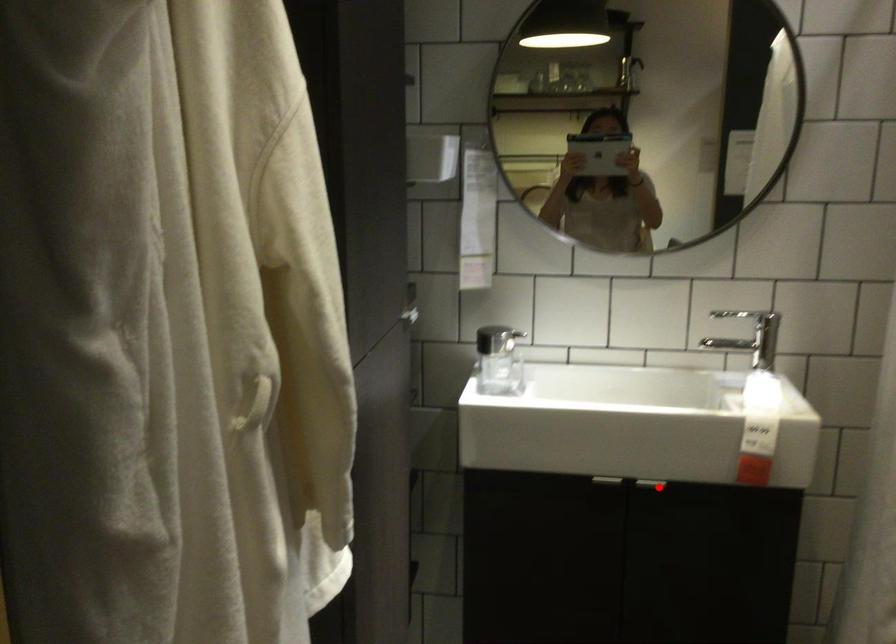
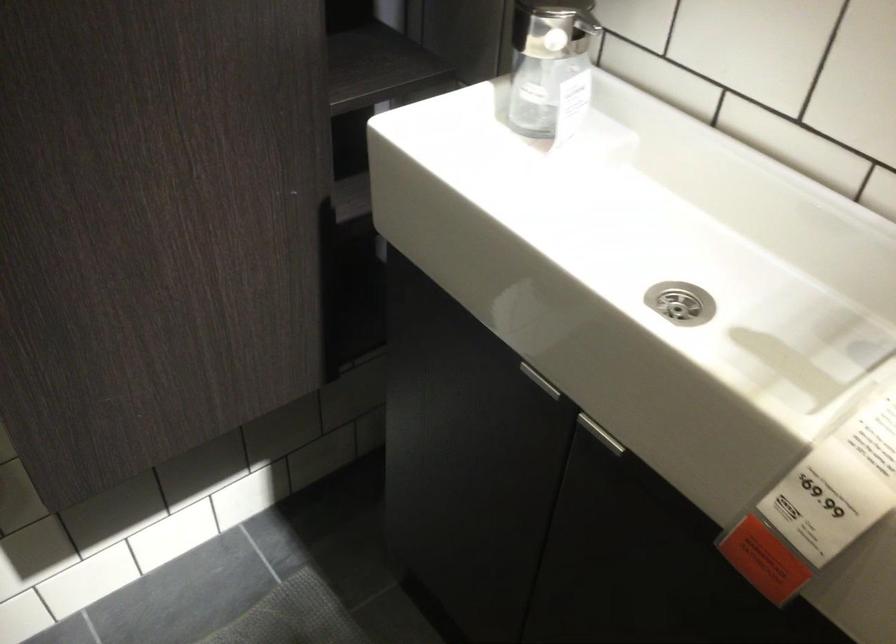
The point at the highlighted location is marked in the first image. Where is the corresponding point in the second image?

(599, 433)